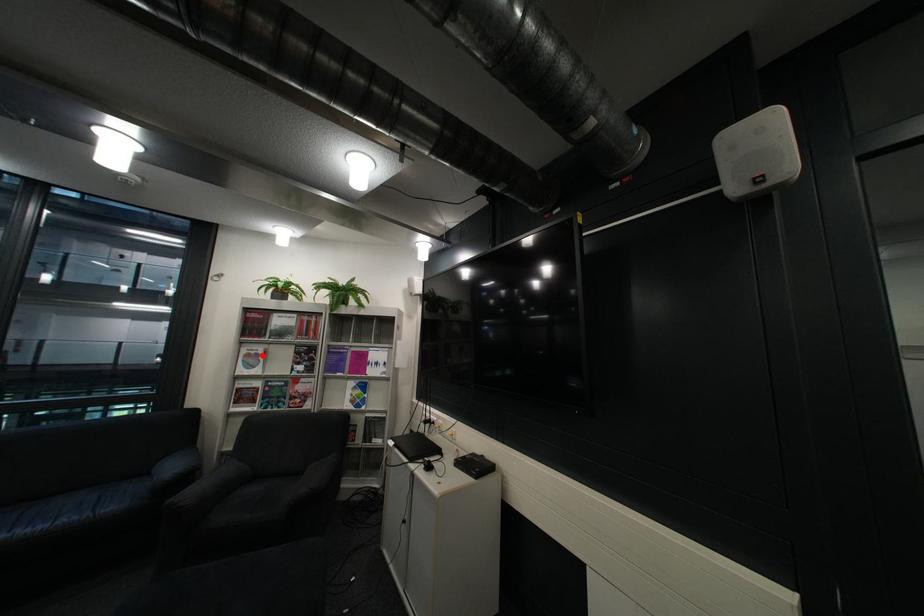
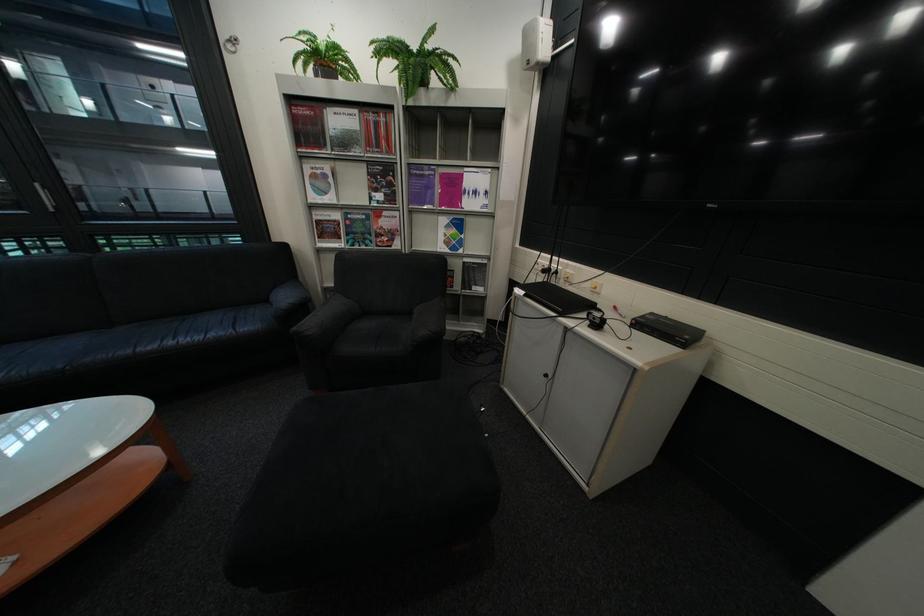
Question: I am providing you with two images of the same scene from different viewpoints. Image1 has a red point marked. In image2, the corresponding 3D location appears at what relative position? Reply with the corresponding letter.

Choices:
 (A) Closer
 (B) Farther

Answer: (A)